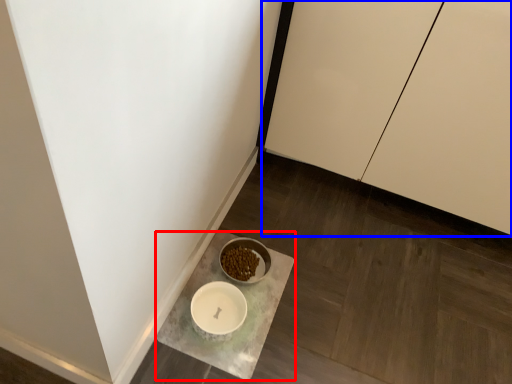
Question: Which object appears farthest to the camera in this image, counter (highlighted by a red box) or cabinetry (highlighted by a blue box)?

Choices:
 (A) counter
 (B) cabinetry

Answer: (A)